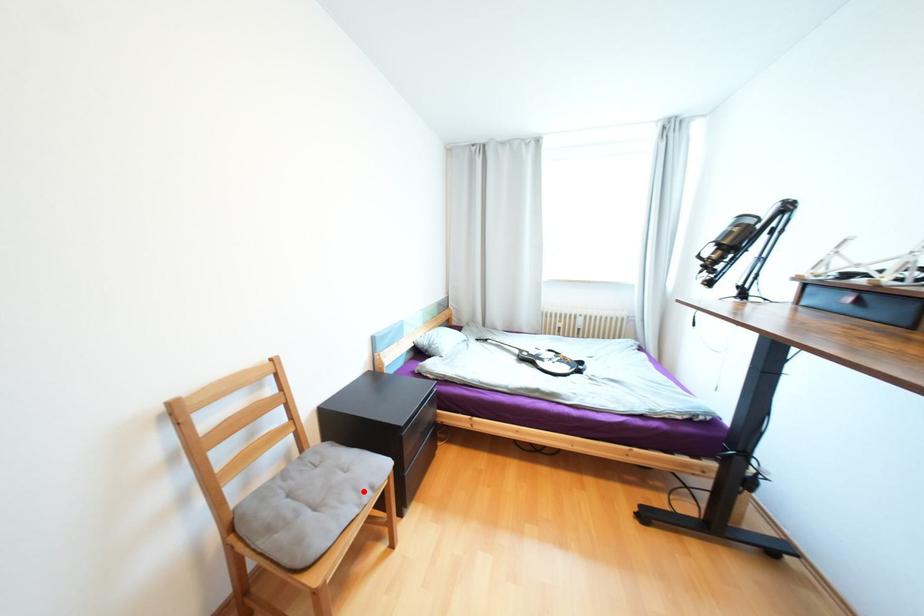
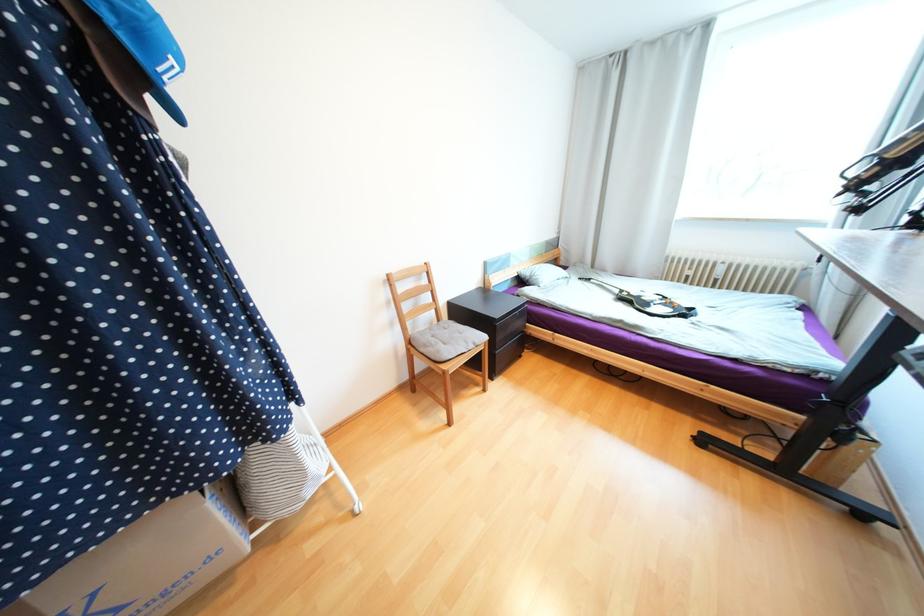
Question: I am providing you with two images of the same scene from different viewpoints. Given a red point in image1, look at the same physical point in image2. Is it:

Choices:
 (A) Closer to the viewpoint
 (B) Farther from the viewpoint

Answer: (A)